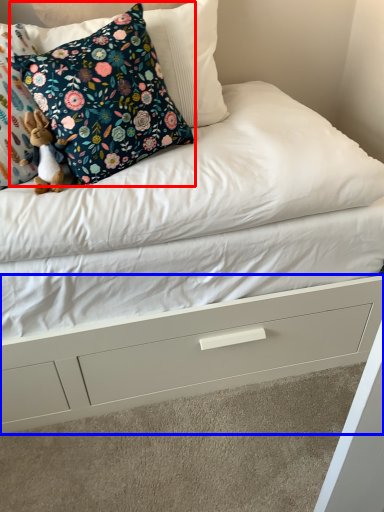
Question: Which of the following is the farthest to the observer, pillow (highlighted by a red box) or drawer (highlighted by a blue box)?

Choices:
 (A) pillow
 (B) drawer

Answer: (B)